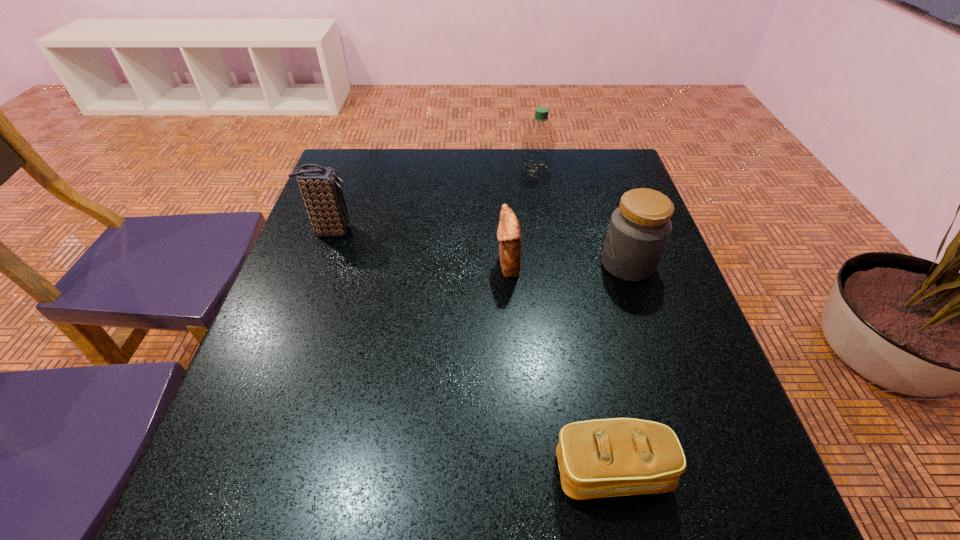
Locate an element on the screen. The width and height of the screenshot is (960, 540). free space between the jar and the leftmost clutch bag is located at coordinates (479, 247).

Where is `vacant region between the water bottle and the jar`? The image size is (960, 540). vacant region between the water bottle and the jar is located at coordinates (582, 218).

Where is `free area in between the farthest object and the tallest clutch bag`? free area in between the farthest object and the tallest clutch bag is located at coordinates (433, 201).

Find the location of a particular element. empty space that is in between the leftmost object and the jar is located at coordinates (479, 247).

Locate an element on the screen. This screenshot has height=540, width=960. free space that is in between the jar and the shortest clutch bag is located at coordinates (620, 367).

You are a GUI agent. You are given a task and a screenshot of the screen. Output one action in this format:
    pyautogui.click(x=<x>, y=<y>)
    Task: Click on the free area in between the second clutch bag from right to left and the jar
    This screenshot has height=540, width=960.
    Given the screenshot: What is the action you would take?
    pyautogui.click(x=567, y=265)

Locate an element on the screen. free space that is in between the water bottle and the rightmost clutch bag is located at coordinates (574, 321).

The width and height of the screenshot is (960, 540). Find the location of `free space that is in between the second clutch bag from right to left and the nearest object`. free space that is in between the second clutch bag from right to left and the nearest object is located at coordinates (561, 368).

You are a GUI agent. You are given a task and a screenshot of the screen. Output one action in this format:
    pyautogui.click(x=<x>, y=<y>)
    Task: Click on the vacant space that is in between the jar and the fourth nearest object
    
    Given the screenshot: What is the action you would take?
    pyautogui.click(x=479, y=247)

Locate an element on the screen. The height and width of the screenshot is (540, 960). the second closest object to the fourth tallest object is located at coordinates (538, 142).